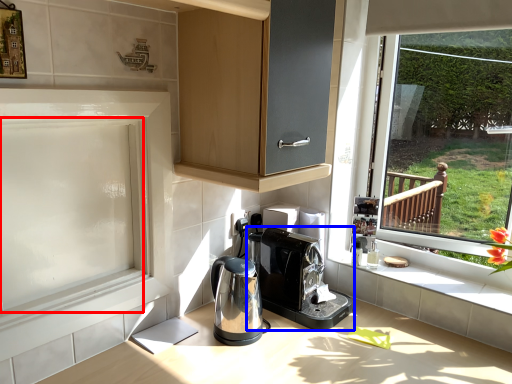
Question: Which point is closer to the camera, screen door (highlighted by a red box) or home appliance (highlighted by a blue box)?

Choices:
 (A) screen door
 (B) home appliance

Answer: (A)